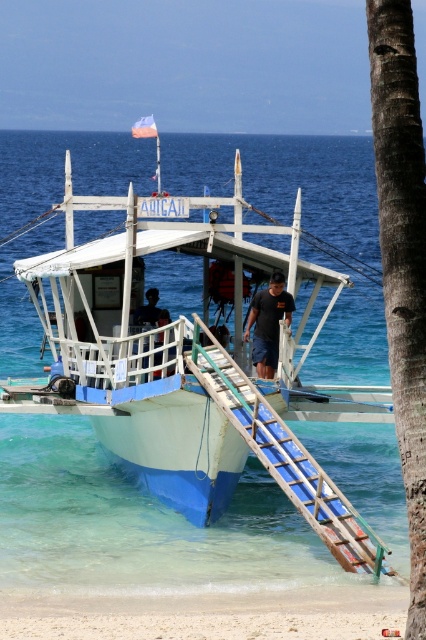
You are standing on the beach and see the boat marked by point (137, 516). What is the name of the boat?

The boat marked by point (137, 516) is named ABIGAIL.

You are a tourist standing on the beach and want to board the banca. You see the blue plastic ladder at lower center and the dark blue shorts at center. Which object is nearer to you?

The blue plastic ladder at lower center is closer to the viewer than the dark blue shorts at center, so the blue plastic ladder at lower center is nearer to you.